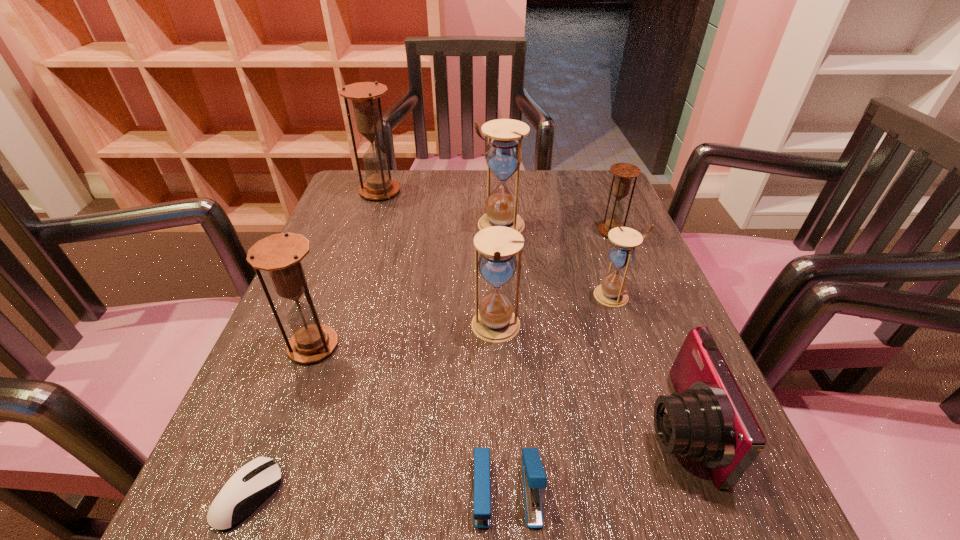
The height and width of the screenshot is (540, 960). In order to click on the biggest brown hourglass in this screenshot , I will do `click(365, 96)`.

The width and height of the screenshot is (960, 540). I want to click on the farthest brown hourglass, so click(365, 96).

The image size is (960, 540). Identify the location of the biggest white hourglass. (503, 155).

The image size is (960, 540). In order to click on the second biggest white hourglass in this screenshot , I will do `click(495, 322)`.

The height and width of the screenshot is (540, 960). In order to click on the second biggest brown hourglass in this screenshot , I will do pyautogui.click(x=281, y=254).

The width and height of the screenshot is (960, 540). What are the coordinates of `the rightmost brown hourglass` in the screenshot? It's located at (623, 173).

You are a GUI agent. You are given a task and a screenshot of the screen. Output one action in this format:
    pyautogui.click(x=<x>, y=<y>)
    Task: Click on the smallest brown hourglass
    The height and width of the screenshot is (540, 960).
    Given the screenshot: What is the action you would take?
    pyautogui.click(x=623, y=173)

Locate an element on the screen. the smallest white hourglass is located at coordinates (612, 292).

Find the location of a particular element. The image size is (960, 540). the third shortest object is located at coordinates (708, 419).

This screenshot has width=960, height=540. Identify the location of the second shortest object. (534, 478).